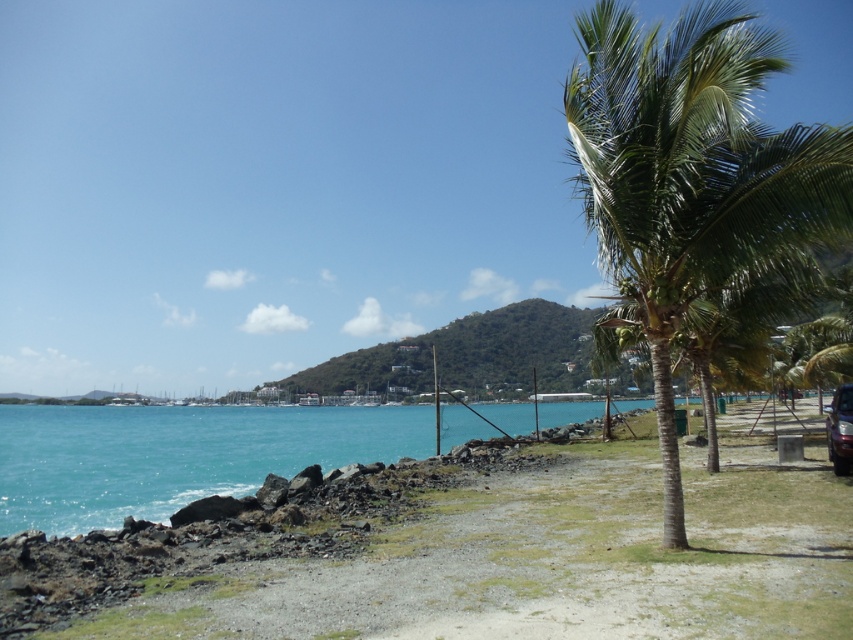
Question: Does smooth sand beach at lower center appear on the right side of turquoise water at lower left?

Choices:
 (A) yes
 (B) no

Answer: (A)

Question: Which point is closer to the camera?

Choices:
 (A) metallic silver car at right
 (B) green leafy palm tree at right
 (C) smooth sand beach at lower center

Answer: (C)

Question: Which object is farther from the camera taking this photo?

Choices:
 (A) smooth sand beach at lower center
 (B) turquoise water at lower left
 (C) metallic silver car at right
 (D) green leafy palm tree at right

Answer: (B)

Question: Observing the image, what is the correct spatial positioning of green leafy palm tree at right in reference to turquoise water at lower left?

Choices:
 (A) left
 (B) right

Answer: (B)

Question: Is green leafy palm tree at right to the left of metallic silver car at right from the viewer's perspective?

Choices:
 (A) yes
 (B) no

Answer: (A)

Question: Estimate the real-world distances between objects in this image. Which object is farther from the smooth sand beach at lower center?

Choices:
 (A) green leafy palm tree at right
 (B) metallic silver car at right

Answer: (A)